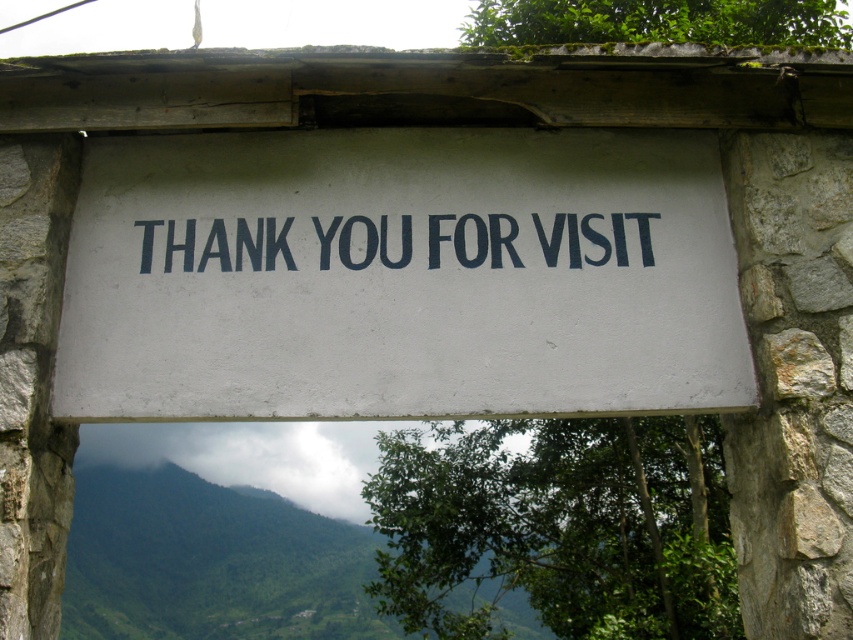
You are standing in front of the stone archway and want to place a small flower pot exactly at the center of the white matte sign at center. According to the coordinates provided, where should you position the flower pot?

The white matte sign at center is located at point (399, 276), so you should position the flower pot at those coordinates to place it exactly at the center of the white matte sign at center.